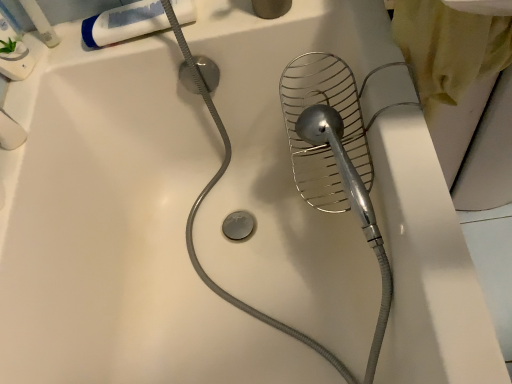
Question: Is white matte tube at upper left aimed at white plastic tube at upper left?

Choices:
 (A) yes
 (B) no

Answer: (B)

Question: Does white matte tube at upper left appear on the right side of white plastic tube at upper left?

Choices:
 (A) no
 (B) yes

Answer: (B)

Question: Is white plastic tube at upper left surrounded by white matte tube at upper left?

Choices:
 (A) no
 (B) yes

Answer: (A)

Question: Considering the relative sizes of white matte tube at upper left and white plastic tube at upper left in the image provided, is white matte tube at upper left shorter than white plastic tube at upper left?

Choices:
 (A) no
 (B) yes

Answer: (B)

Question: Is the position of white matte tube at upper left more distant than that of white plastic tube at upper left?

Choices:
 (A) no
 (B) yes

Answer: (B)

Question: From the image's perspective, is white matte tube at upper left beneath white plastic tube at upper left?

Choices:
 (A) no
 (B) yes

Answer: (B)

Question: Are white plastic tube at upper left and white matte tube at upper left located far from each other?

Choices:
 (A) yes
 (B) no

Answer: (B)

Question: Is white plastic tube at upper left completely or partially outside of white matte tube at upper left?

Choices:
 (A) yes
 (B) no

Answer: (A)

Question: From a real-world perspective, does white plastic tube at upper left stand above white matte tube at upper left?

Choices:
 (A) yes
 (B) no

Answer: (A)

Question: Is white matte tube at upper left a part of white plastic tube at upper left?

Choices:
 (A) no
 (B) yes

Answer: (A)

Question: Is white plastic tube at upper left bigger than white matte tube at upper left?

Choices:
 (A) no
 (B) yes

Answer: (A)

Question: Is white plastic tube at upper left positioned with its back to white matte tube at upper left?

Choices:
 (A) no
 (B) yes

Answer: (A)

Question: Considering the positions of white matte tube at upper left and white plastic tube at upper left in the image, is white matte tube at upper left wider or thinner than white plastic tube at upper left?

Choices:
 (A) wide
 (B) thin

Answer: (A)